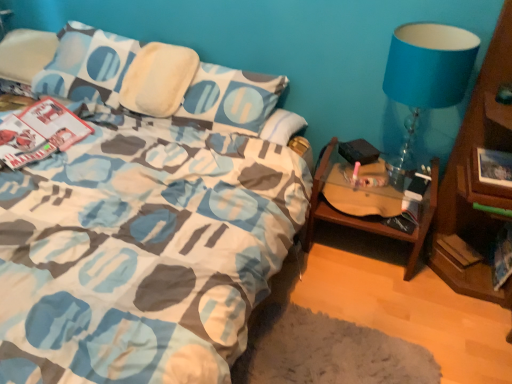
The height and width of the screenshot is (384, 512). Identify the location of vacant area that is in front of hardcover book at lower right. (457, 295).